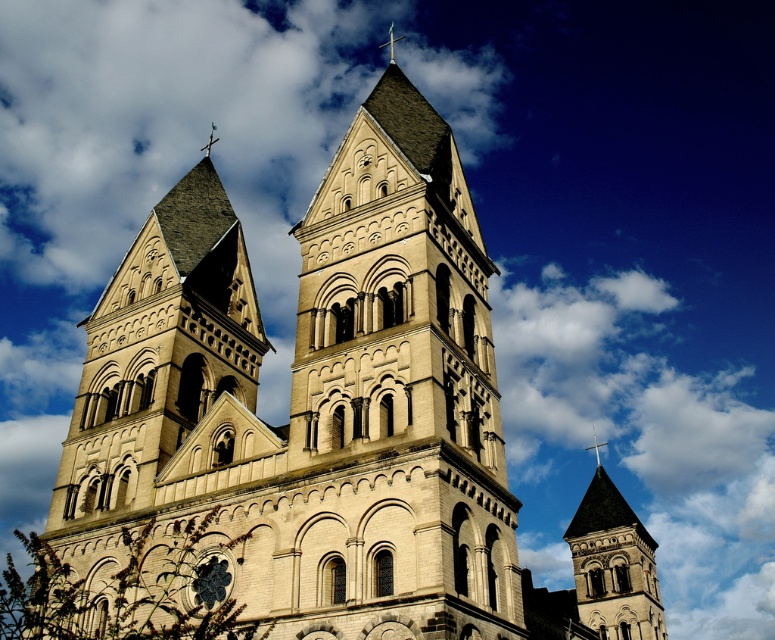
You are standing at the point marked as point (133,419) and want to take a photo of the church. Your camera has a maximum focus range of 50 meters. Will you be able to focus on the church from your current position?

The distance between you and the church is 49.80 meters, which is within the camera maximum focus range of 50 meters. Therefore, you can focus on the church from your current position.

You are standing in front of the church and notice two towers. The beige stone tower at center and the smooth gray stone tower at center. Which tower is positioned higher up in the image?

The beige stone tower at center is positioned higher up in the image than the smooth gray stone tower at center, as it is located above it.

You are standing in front of the church and want to place a new decoration between the beige stone tower at center and the smooth silver cross at upper center. Which object should the decoration be placed closer to in order to appear closer to the viewer?

The beige stone tower at center is closer to the viewer than the smooth silver cross at upper center, so the decoration should be placed closer to the beige stone tower at center to appear closer.